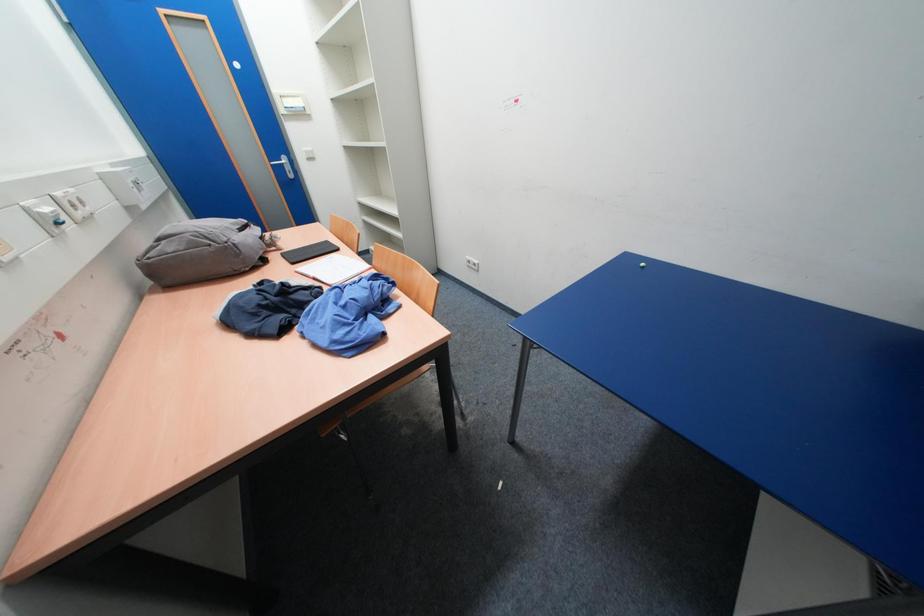
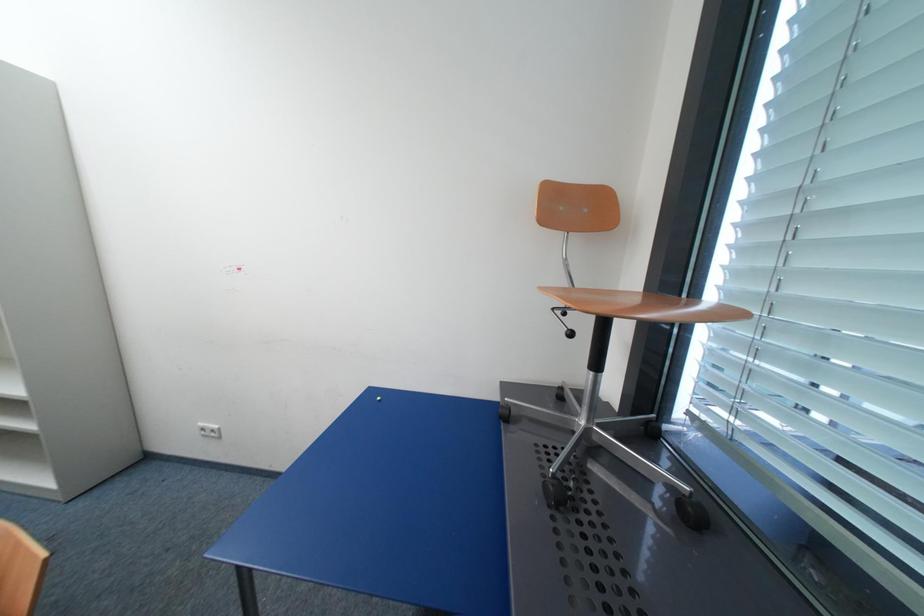
How did the camera likely rotate?

The camera rotated toward right-up.